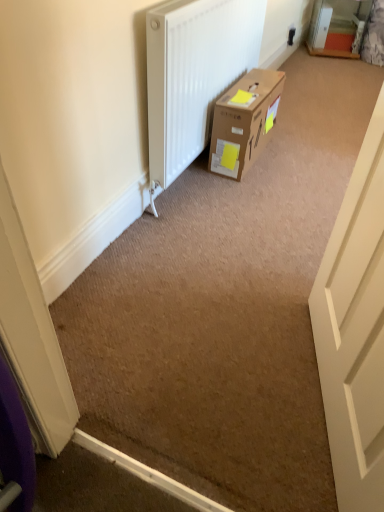
Question: From the image's perspective, does white plastic electric outlet at upper right appear higher than brown cardboard box at center?

Choices:
 (A) no
 (B) yes

Answer: (B)

Question: Is white plastic electric outlet at upper right in front of brown cardboard box at center?

Choices:
 (A) no
 (B) yes

Answer: (A)

Question: Does white plastic electric outlet at upper right appear on the left side of brown cardboard box at center?

Choices:
 (A) no
 (B) yes

Answer: (A)

Question: From the image's perspective, is white plastic electric outlet at upper right beneath brown cardboard box at center?

Choices:
 (A) yes
 (B) no

Answer: (B)

Question: Does white plastic electric outlet at upper right come behind brown cardboard box at center?

Choices:
 (A) yes
 (B) no

Answer: (A)

Question: Does white plastic electric outlet at upper right have a lesser width compared to brown cardboard box at center?

Choices:
 (A) yes
 (B) no

Answer: (A)

Question: Does white plastic electric outlet at upper right have a lesser width compared to white matte door at right?

Choices:
 (A) yes
 (B) no

Answer: (A)

Question: Is white plastic electric outlet at upper right facing away from white matte door at right?

Choices:
 (A) no
 (B) yes

Answer: (A)

Question: From a real-world perspective, is white plastic electric outlet at upper right located higher than white matte door at right?

Choices:
 (A) no
 (B) yes

Answer: (A)

Question: Considering the relative sizes of white plastic electric outlet at upper right and white matte door at right in the image provided, is white plastic electric outlet at upper right taller than white matte door at right?

Choices:
 (A) no
 (B) yes

Answer: (A)

Question: Is white plastic electric outlet at upper right surrounding white matte door at right?

Choices:
 (A) no
 (B) yes

Answer: (A)

Question: Is white plastic electric outlet at upper right outside white matte door at right?

Choices:
 (A) no
 (B) yes

Answer: (B)

Question: From a real-world perspective, is brown cardboard box at center located beneath white matte door at right?

Choices:
 (A) yes
 (B) no

Answer: (A)